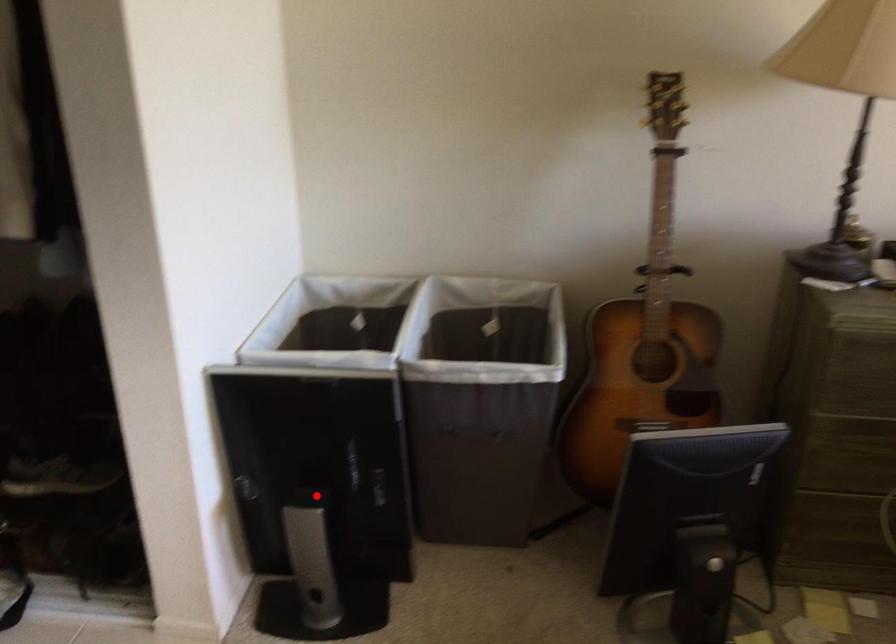
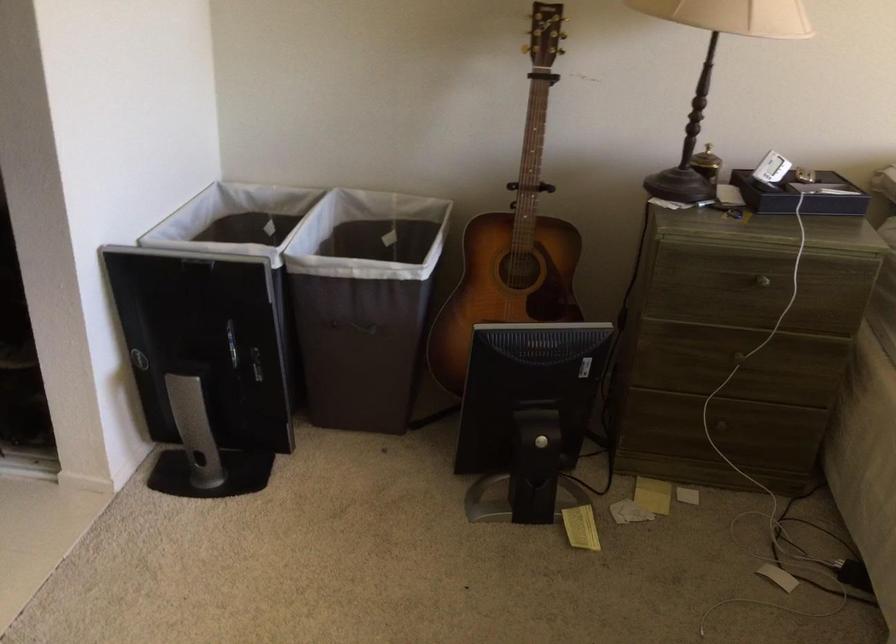
Question: I am providing you with two images of the same scene from different viewpoints. In image1, a red point is highlighted. Considering the same 3D point in image2, which of the following is correct?

Choices:
 (A) It is closer
 (B) It is farther

Answer: (B)